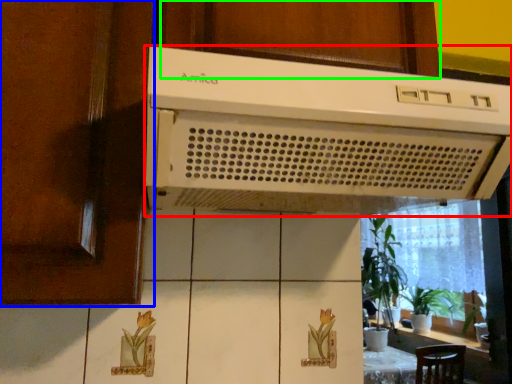
Question: Based on their relative distances, which object is nearer to home appliance (highlighted by a red box)? Choose from screen door (highlighted by a blue box) and cabinetry (highlighted by a green box).

Choices:
 (A) screen door
 (B) cabinetry

Answer: (B)